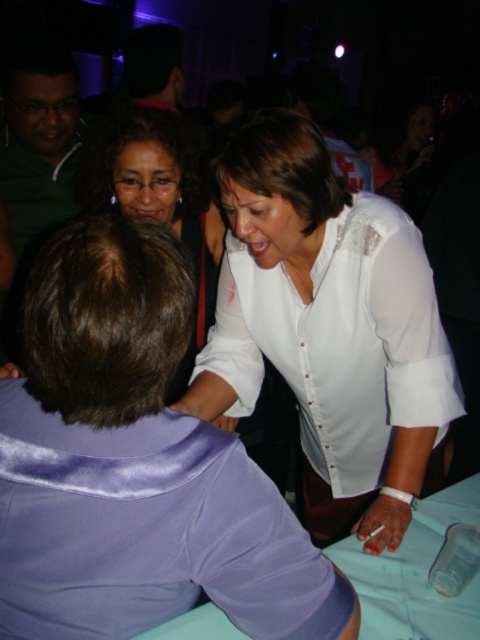
Question: Is matte black hair at upper center closer to camera compared to light blue satin tablecloth at lower center?

Choices:
 (A) yes
 (B) no

Answer: (B)

Question: Which point appears farthest from the camera in this image?

Choices:
 (A) (472, 545)
 (B) (202, 202)
 (C) (405, 605)
 (D) (298, 218)

Answer: (B)

Question: Does light blue satin tablecloth at lower center have a larger size compared to clear plastic bottle at lower right?

Choices:
 (A) yes
 (B) no

Answer: (A)

Question: Among these points, which one is farthest from the camera?

Choices:
 (A) (474, 493)
 (B) (168, 212)
 (C) (239, 368)
 (D) (54, 205)

Answer: (D)

Question: Can you confirm if matte black hair at upper center is positioned to the right of clear plastic bottle at lower right?

Choices:
 (A) yes
 (B) no

Answer: (B)

Question: Considering the real-world distances, which object is farthest from the green matte shirt at upper left?

Choices:
 (A) white satin blouse at center
 (B) clear plastic bottle at lower right
 (C) matte black hair at upper center
 (D) light blue satin tablecloth at lower center

Answer: (B)